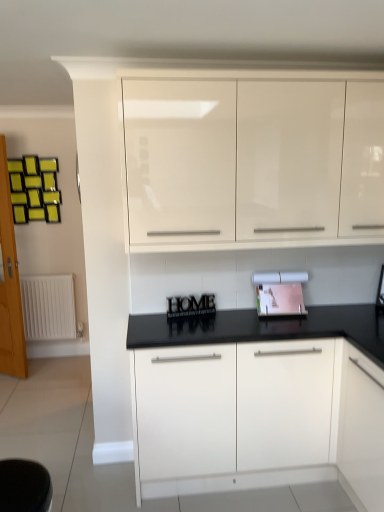
Describe the element at coordinates (48, 307) in the screenshot. This screenshot has height=512, width=384. I see `white matte radiator at left` at that location.

You are a GUI agent. You are given a task and a screenshot of the screen. Output one action in this format:
    pyautogui.click(x=<x>, y=<y>)
    Task: Click on the wooden letters at center
    
    Given the screenshot: What is the action you would take?
    pyautogui.click(x=190, y=306)

Describe the element at coordinates (247, 157) in the screenshot. I see `glossy white cabinets at upper center, the first cabinetry in the top-to-bottom sequence` at that location.

In the scene shown: In order to face matte pink paper at center, should I rotate leftwards or rightwards?

It's best to rotate right around 12.071 degrees.

This screenshot has height=512, width=384. What do you see at coordinates (258, 401) in the screenshot?
I see `white glossy cabinet at center, the first cabinetry from the bottom` at bounding box center [258, 401].

From the picture: Measure the distance between wooden glass door at left and camera.

10.34 feet.

Describe the element at coordinates (10, 284) in the screenshot. I see `wooden glass door at left` at that location.

The image size is (384, 512). In order to click on white matte radiator at left in this screenshot , I will do `click(48, 307)`.

From the image's perspective, does matte pink paper at center appear lower than white glossy cabinet at center, the first cabinetry from the bottom?

No, from the image's perspective, matte pink paper at center is not beneath white glossy cabinet at center, the first cabinetry from the bottom.

Would you say matte pink paper at center is to the left or to the right of white glossy cabinet at center, which appears as the 2th cabinetry when viewed from the top, in the picture?

matte pink paper at center is positioned on white glossy cabinet at center, which appears as the 2th cabinetry when viewed from the top,'s right side.

Is matte pink paper at center further to the viewer compared to white glossy cabinet at center, the first cabinetry from the bottom?

That is True.

Does matte pink paper at center have a lesser width compared to white glossy cabinet at center, which appears as the 2th cabinetry when viewed from the top?

Yes, matte pink paper at center is thinner than white glossy cabinet at center, which appears as the 2th cabinetry when viewed from the top.

Is wooden glass door at left not close to white glossy cabinet at center, the first cabinetry from the bottom?

wooden glass door at left is far away from white glossy cabinet at center, the first cabinetry from the bottom.

Is wooden glass door at left wider or thinner than white glossy cabinet at center, the first cabinetry from the bottom?

wooden glass door at left is thinner than white glossy cabinet at center, the first cabinetry from the bottom.

Is wooden glass door at left positioned with its back to white glossy cabinet at center, which appears as the 2th cabinetry when viewed from the top?

wooden glass door at left is not turned away from white glossy cabinet at center, which appears as the 2th cabinetry when viewed from the top.

From the image's perspective, is matte pink paper at center positioned above or below wooden glass door at left?

matte pink paper at center is below wooden glass door at left.

From a real-world perspective, is matte pink paper at center beneath wooden glass door at left?

Incorrect, from a real-world perspective, matte pink paper at center is higher than wooden glass door at left.

Choose the correct answer: Is matte pink paper at center inside wooden glass door at left or outside it?

matte pink paper at center is spatially situated outside wooden glass door at left.

Locate an element on the screen. glass door that is on the left side of matte pink paper at center is located at coordinates (10, 284).

From the image's perspective, which one is positioned lower, wooden letters at center or wooden glass door at left?

wooden letters at center.

Which is more to the right, wooden letters at center or wooden glass door at left?

wooden letters at center is more to the right.

Is wooden letters at center turned away from wooden glass door at left?

No, wooden glass door at left is not at the back of wooden letters at center.

Which point is more distant from viewer, (x=167, y=318) or (x=4, y=270)?

The point (x=4, y=270) is farther from the camera.

Which is behind, point (266, 309) or point (34, 308)?

Positioned behind is point (34, 308).

Who is shorter, matte pink paper at center or white matte radiator at left?

Standing shorter between the two is matte pink paper at center.

Can you tell me how much matte pink paper at center and white matte radiator at left differ in facing direction?

2.46 degrees.

Is matte pink paper at center looking in the opposite direction of white matte radiator at left?

No, matte pink paper at center's orientation is not away from white matte radiator at left.

Consider the image. Considering the relative sizes of wooden letters at center and white glossy cabinet at center, the first cabinetry from the bottom, in the image provided, is wooden letters at center taller than white glossy cabinet at center, the first cabinetry from the bottom,?

Incorrect, the height of wooden letters at center is not larger of that of white glossy cabinet at center, the first cabinetry from the bottom.

Which point is more forward, (x=186, y=301) or (x=304, y=367)?

The point (x=304, y=367) is in front.

From the image's perspective, is wooden letters at center above or below white glossy cabinet at center, which appears as the 2th cabinetry when viewed from the top?

Clearly, from the image's perspective, wooden letters at center is above white glossy cabinet at center, which appears as the 2th cabinetry when viewed from the top.

Locate an element on the screen. This screenshot has height=512, width=384. cabinetry below the wooden letters at center (from a real-world perspective) is located at coordinates (258, 401).

What's the angular difference between wooden letters at center and matte pink paper at center's facing directions?

14.5 degrees.

Can you confirm if wooden letters at center is thinner than matte pink paper at center?

Yes, wooden letters at center is thinner than matte pink paper at center.

Can we say wooden letters at center lies outside matte pink paper at center?

Yes.

Where is `cabinetry that is the 1st one when counting forward from the matte pink paper at center`? cabinetry that is the 1st one when counting forward from the matte pink paper at center is located at coordinates (258, 401).

Image resolution: width=384 pixels, height=512 pixels. What are the coordinates of `glass door behind the white glossy cabinet at center, the first cabinetry from the bottom` in the screenshot? It's located at tap(10, 284).

Based on their spatial positions, is matte pink paper at center or glossy white cabinets at upper center, the first cabinetry in the top-to-bottom sequence, closer to white glossy cabinet at center, which appears as the 2th cabinetry when viewed from the top?

matte pink paper at center.

When comparing their distances from white matte radiator at left, does white glossy cabinet at center, the first cabinetry from the bottom, or wooden letters at center seem further?

white glossy cabinet at center, the first cabinetry from the bottom, is further to white matte radiator at left.

Estimate the real-world distances between objects in this image. Which object is further from white glossy cabinet at center, which appears as the 2th cabinetry when viewed from the top, white matte radiator at left or wooden letters at center?

white matte radiator at left.

When comparing their distances from wooden letters at center, does wooden glass door at left or glossy white cabinets at upper center, the first cabinetry in the top-to-bottom sequence, seem further?

wooden glass door at left.

From the image, which object appears to be farther from wooden letters at center, matte pink paper at center or wooden glass door at left?

Based on the image, wooden glass door at left appears to be further to wooden letters at center.

Which object lies nearer to the anchor point wooden glass door at left, wooden letters at center or glossy white cabinets at upper center, the second cabinetry in the bottom-to-top sequence?

wooden letters at center is closer to wooden glass door at left.

When comparing their distances from white matte radiator at left, does wooden letters at center or matte pink paper at center seem further?

The object further to white matte radiator at left is matte pink paper at center.

Estimate the real-world distances between objects in this image. Which object is further from white glossy cabinet at center, the first cabinetry from the bottom, wooden letters at center or white matte radiator at left?

Among the two, white matte radiator at left is located further to white glossy cabinet at center, the first cabinetry from the bottom.

I want to click on writing between matte pink paper at center and white glossy cabinet at center, the first cabinetry from the bottom, in the up-down direction, so click(x=190, y=306).

The image size is (384, 512). In order to click on radiator situated between wooden glass door at left and white glossy cabinet at center, the first cabinetry from the bottom, from left to right in this screenshot , I will do `click(48, 307)`.

This screenshot has width=384, height=512. Find the location of `writing between glossy white cabinets at upper center, the first cabinetry in the top-to-bottom sequence, and white glossy cabinet at center, which appears as the 2th cabinetry when viewed from the top, from top to bottom`. writing between glossy white cabinets at upper center, the first cabinetry in the top-to-bottom sequence, and white glossy cabinet at center, which appears as the 2th cabinetry when viewed from the top, from top to bottom is located at coordinates (190, 306).

The height and width of the screenshot is (512, 384). I want to click on appliance between glossy white cabinets at upper center, the first cabinetry in the top-to-bottom sequence, and wooden letters at center in the up-down direction, so click(279, 293).